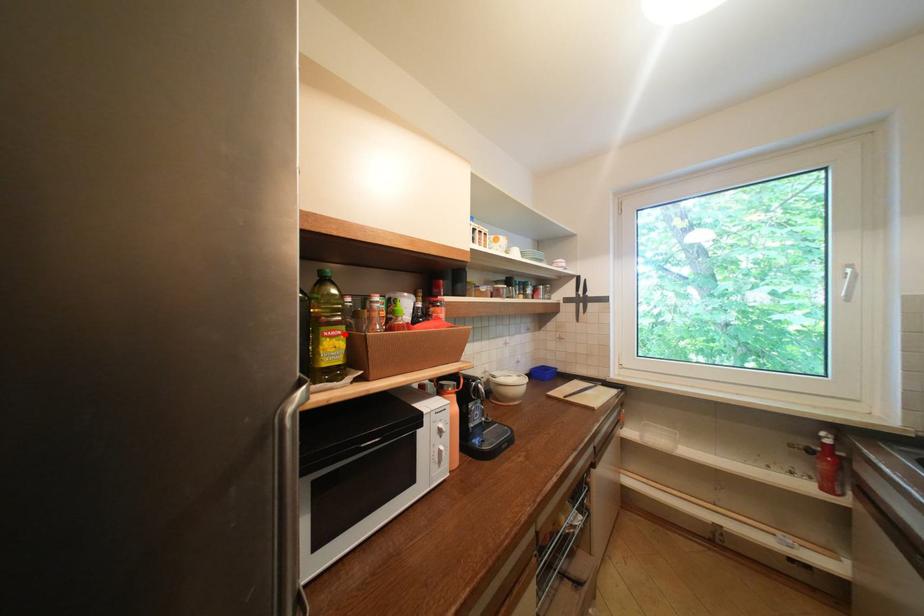
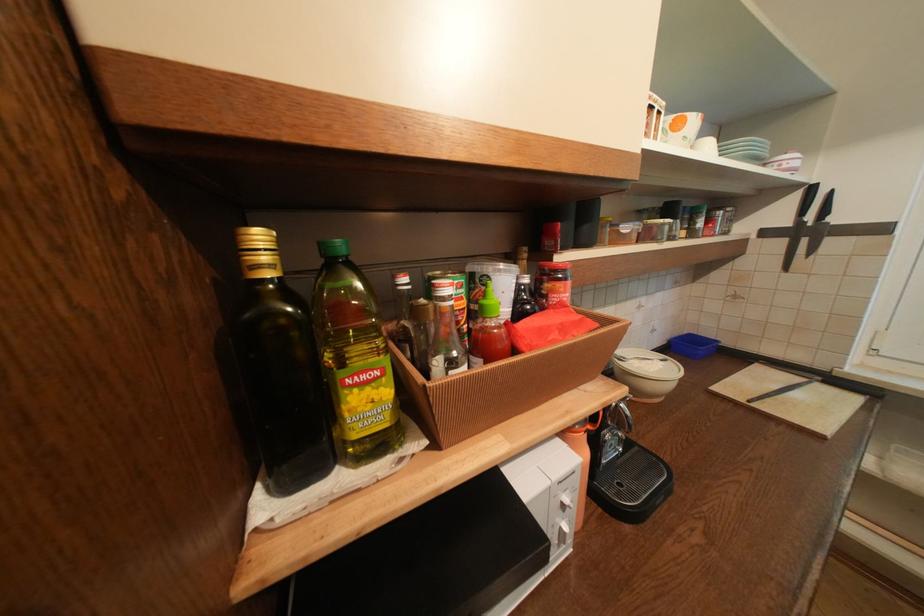
Where in the second image is the point corresponding to the highlighted location from the first image?

(379, 377)